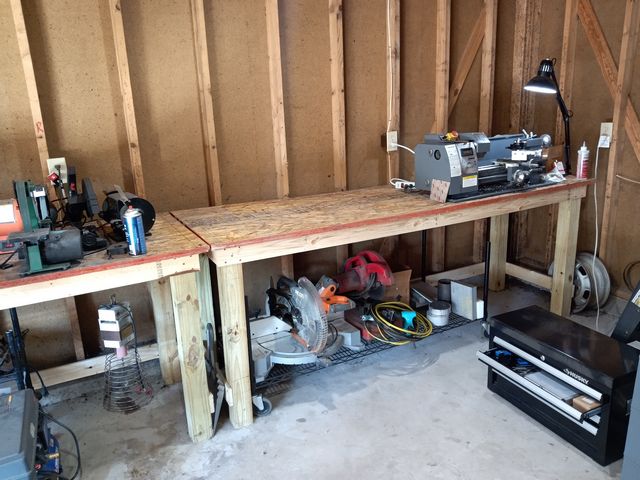
You are a GUI agent. You are given a task and a screenshot of the screen. Output one action in this format:
    pyautogui.click(x=<x>, y=<y>)
    Task: Click on the wooden work bench
    The width and height of the screenshot is (640, 480).
    Given the screenshot: What is the action you would take?
    pyautogui.click(x=278, y=222), pyautogui.click(x=96, y=282)